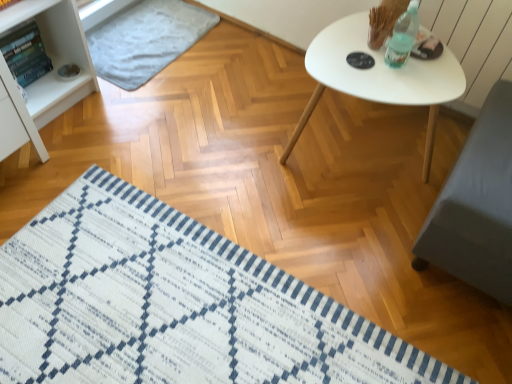
The width and height of the screenshot is (512, 384). I want to click on free spot in front of white matte table at upper right, so click(366, 274).